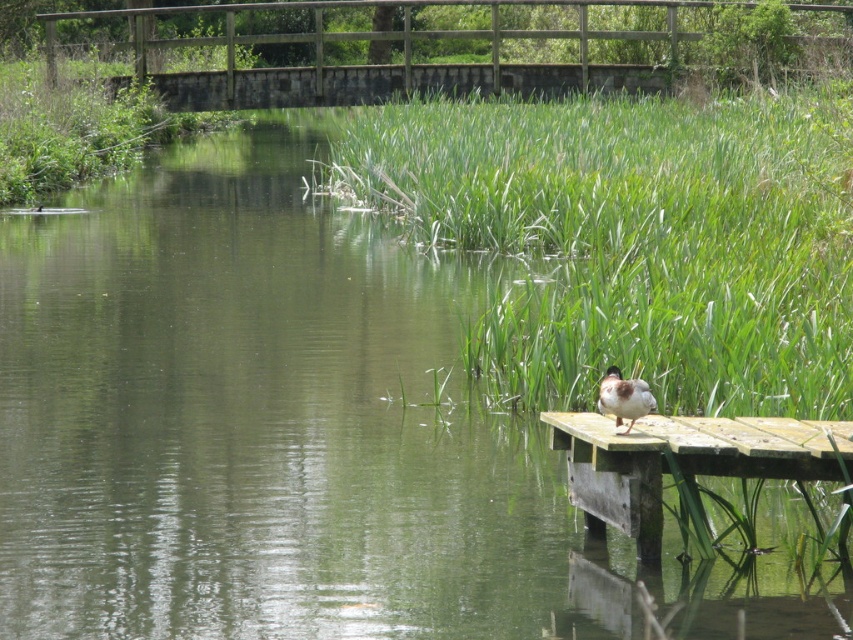
Is point (732, 440) more distant than point (608, 396)?

No.

Between weathered wood dock at right and brown feathered duck at right, which one has more height?

With more height is weathered wood dock at right.

This screenshot has height=640, width=853. I want to click on weathered wood dock at right, so click(683, 461).

Does green grass at lower right appear under brown feathered duck at right?

Answer: No.

Is the position of green grass at lower right more distant than that of brown feathered duck at right?

That is True.

Is point (753, 346) more distant than point (605, 392)?

Yes, it is behind point (605, 392).

What are the coordinates of `green grass at lower right` in the screenshot? It's located at (635, 240).

Is green grass at lower right bigger than weathered wood dock at right?

Correct, green grass at lower right is larger in size than weathered wood dock at right.

Describe the element at coordinates (635, 240) in the screenshot. I see `green grass at lower right` at that location.

Locate an element on the screen. This screenshot has height=640, width=853. green grass at lower right is located at coordinates (635, 240).